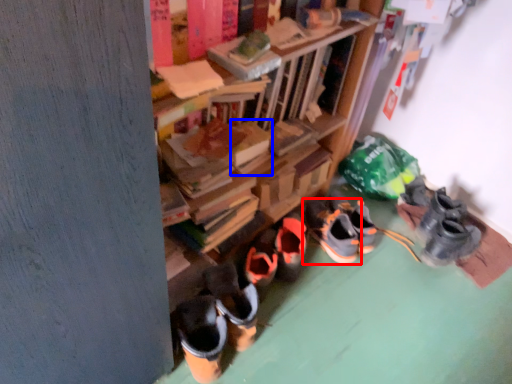
Question: Which point is further to the camera, footwear (highlighted by a red box) or book (highlighted by a blue box)?

Choices:
 (A) footwear
 (B) book

Answer: (A)